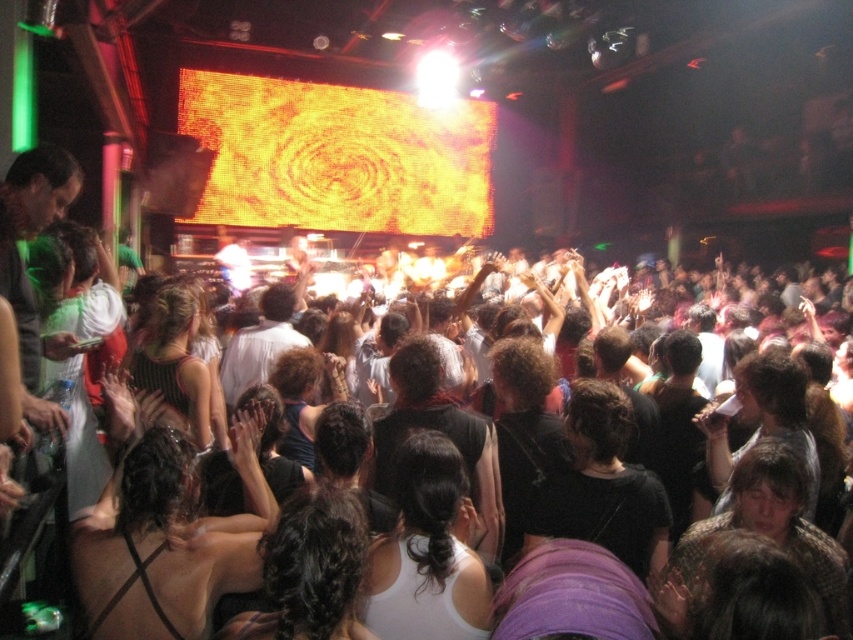
Question: Which point is closer to the camera?

Choices:
 (A) black fabric at center
 (B) dark curly hair at center
 (C) black mesh tank top at center
 (D) dark brown hair at center

Answer: (B)

Question: Which of the following is the closest to the observer?

Choices:
 (A) dark curly hair at center
 (B) black fabric at center

Answer: (A)

Question: Observing the image, what is the correct spatial positioning of dark brown hair at center in reference to black mesh tank top at center?

Choices:
 (A) left
 (B) right

Answer: (B)

Question: Among these objects, which one is nearest to the camera?

Choices:
 (A) dark hair at center
 (B) black fabric at center
 (C) black mesh tank top at center

Answer: (A)

Question: Is dark brown hair at center wider than black mesh tank top at center?

Choices:
 (A) yes
 (B) no

Answer: (A)

Question: Is white matte tank top at center smaller than black mesh tank top at center?

Choices:
 (A) yes
 (B) no

Answer: (A)